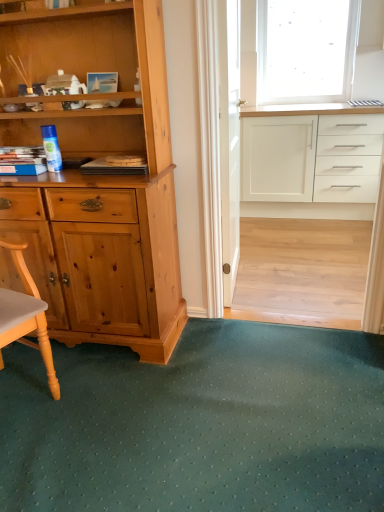
Where is `vacant area situated below clear glass screen door at center (from a real-world perspective)`? vacant area situated below clear glass screen door at center (from a real-world perspective) is located at coordinates (243, 282).